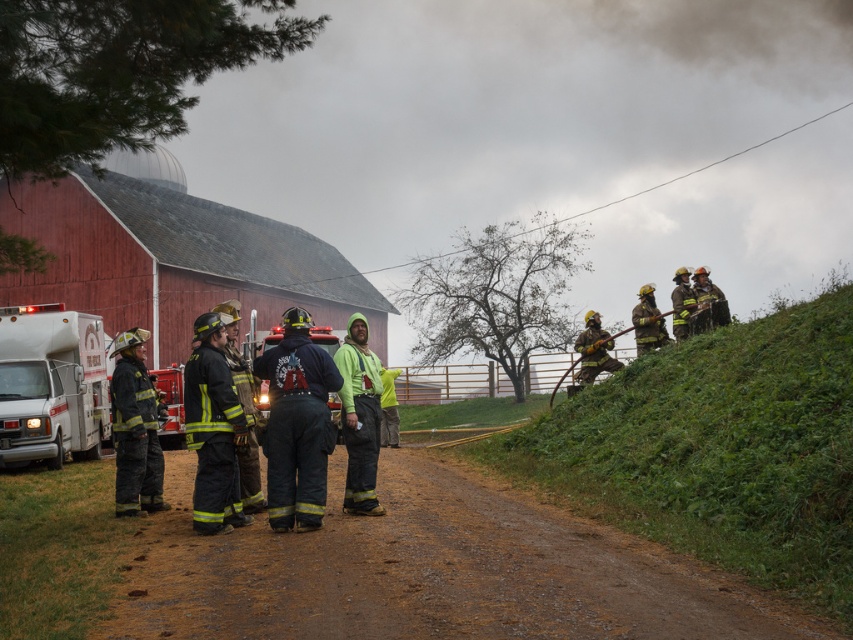
Question: Which of the following is the closest to the observer?

Choices:
 (A) (140, 353)
 (B) (640, 381)
 (C) (250, 365)
 (D) (210, 397)

Answer: (D)

Question: Which of the following is the farthest from the observer?

Choices:
 (A) (613, 365)
 (B) (141, 481)

Answer: (A)

Question: Is red wooden barn at left smaller than shiny silver helmet at right?

Choices:
 (A) yes
 (B) no

Answer: (B)

Question: Can you confirm if shiny silver fire truck at center is smaller than reflective silver helmet at right?

Choices:
 (A) yes
 (B) no

Answer: (B)

Question: Can you confirm if reflective silver helmet at left is positioned above green matte jacket at center?

Choices:
 (A) no
 (B) yes

Answer: (A)

Question: Among these objects, which one is farthest from the camera?

Choices:
 (A) reflective silver helmet at right
 (B) white glossy ambulance at left
 (C) reflective silver helmet at upper right
 (D) shiny black fire truck at center

Answer: (A)